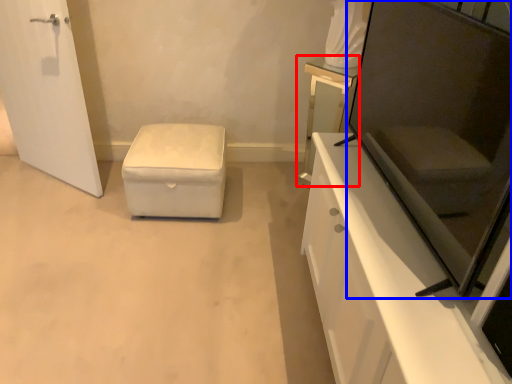
Question: Which object appears farthest to the camera in this image, vanity (highlighted by a red box) or screen door (highlighted by a blue box)?

Choices:
 (A) vanity
 (B) screen door

Answer: (A)